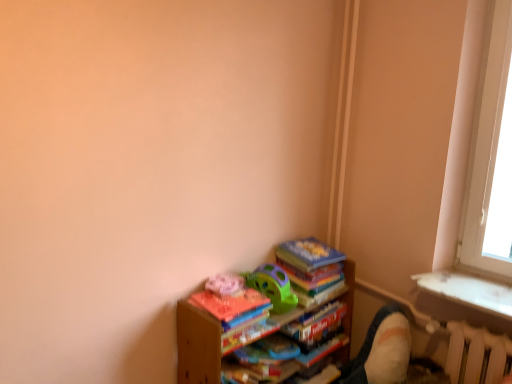
Question: Is white plastic radiator at lower right in front of or behind green plastic toy at center in the image?

Choices:
 (A) front
 (B) behind

Answer: (A)

Question: Looking at their shapes, would you say white plastic radiator at lower right is wider or thinner than green plastic toy at center?

Choices:
 (A) wide
 (B) thin

Answer: (B)

Question: Which object is the closest to the green plastic toy at center?

Choices:
 (A) velvet beige swivel chair at lower right
 (B) wooden books at lower right
 (C) hardcover book at lower center
 (D) white plastic radiator at lower right

Answer: (B)

Question: Which of these objects is positioned closest to the green plastic toy at center?

Choices:
 (A) velvet beige swivel chair at lower right
 (B) wooden books at lower right
 (C) hardcover book at lower center
 (D) white plastic radiator at lower right

Answer: (B)